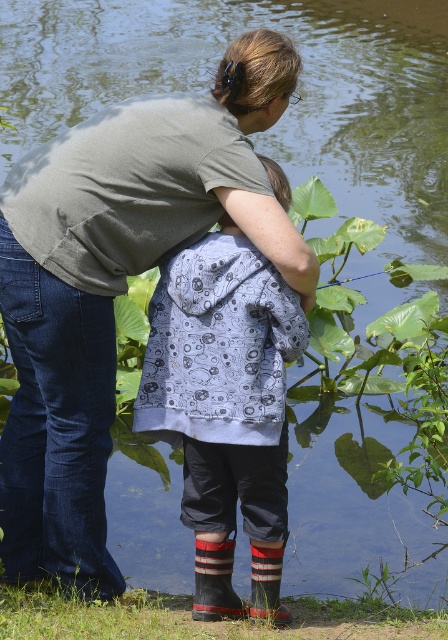
Which is more to the right, patterned fabric hoodie at center or striped wool socks at lower center?

Positioned to the right is striped wool socks at lower center.

Does patterned fabric hoodie at center have a lesser height compared to striped wool socks at lower center?

No.

Find the location of `patterned fabric hoodie at center`. patterned fabric hoodie at center is located at coordinates (223, 397).